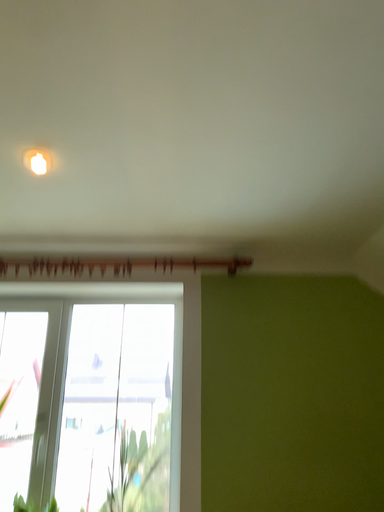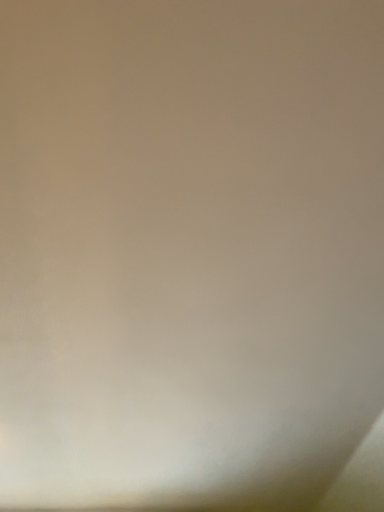
Question: Which way did the camera rotate in the video?

Choices:
 (A) rotated upward
 (B) rotated downward

Answer: (A)